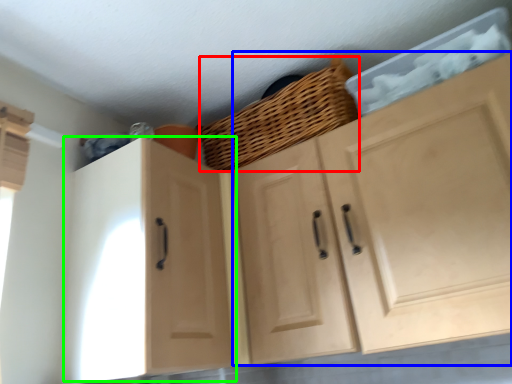
Question: Which object is positioned closest to basket (highlighted by a red box)? Select from cabinetry (highlighted by a blue box) and cabinetry (highlighted by a green box).

Choices:
 (A) cabinetry
 (B) cabinetry

Answer: (A)